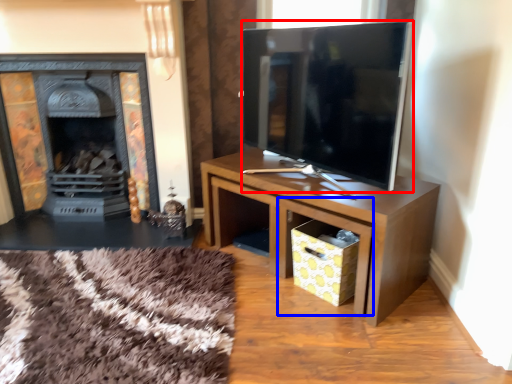
Question: Which point is closer to the camera, television (highlighted by a red box) or drawer (highlighted by a blue box)?

Choices:
 (A) television
 (B) drawer

Answer: (A)